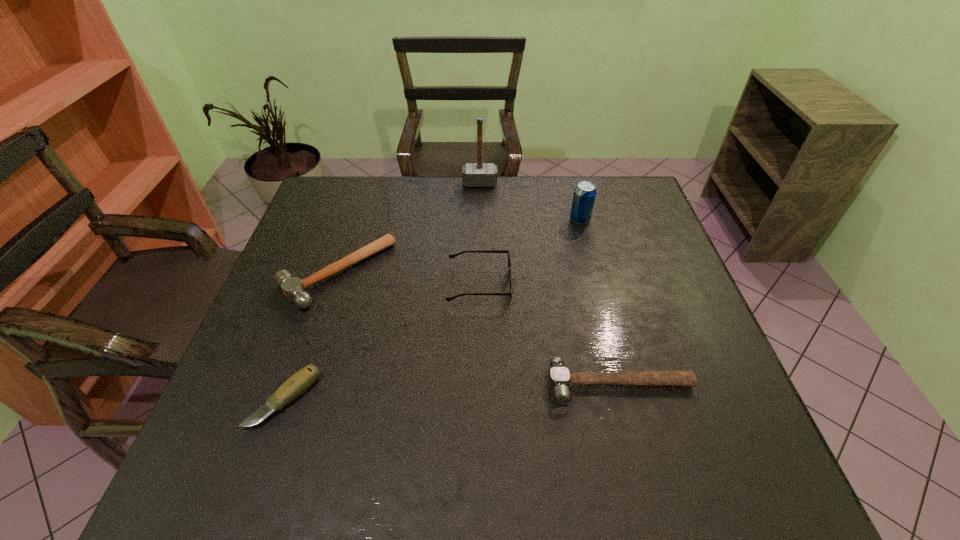
The width and height of the screenshot is (960, 540). What are the coordinates of `free space in the image that satisfies the following two spatial constraints: 1. on the striking surface of the tallest object; 2. on the front lenses of the sunglasses` in the screenshot? It's located at (480, 285).

Where is `vacant region that satisfies the following two spatial constraints: 1. on the striking surface of the farthest hammer; 2. on the right side of the beer can`? vacant region that satisfies the following two spatial constraints: 1. on the striking surface of the farthest hammer; 2. on the right side of the beer can is located at coordinates point(480,220).